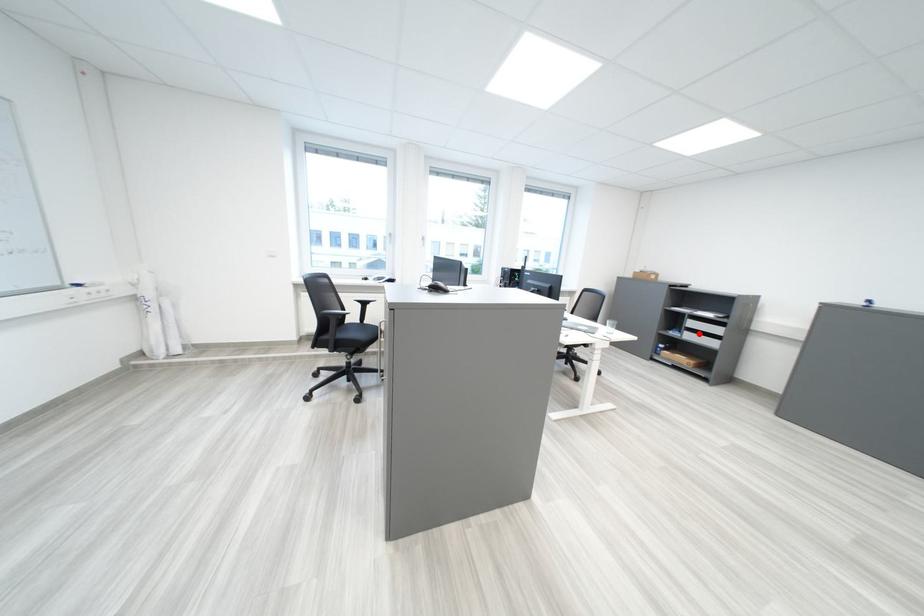
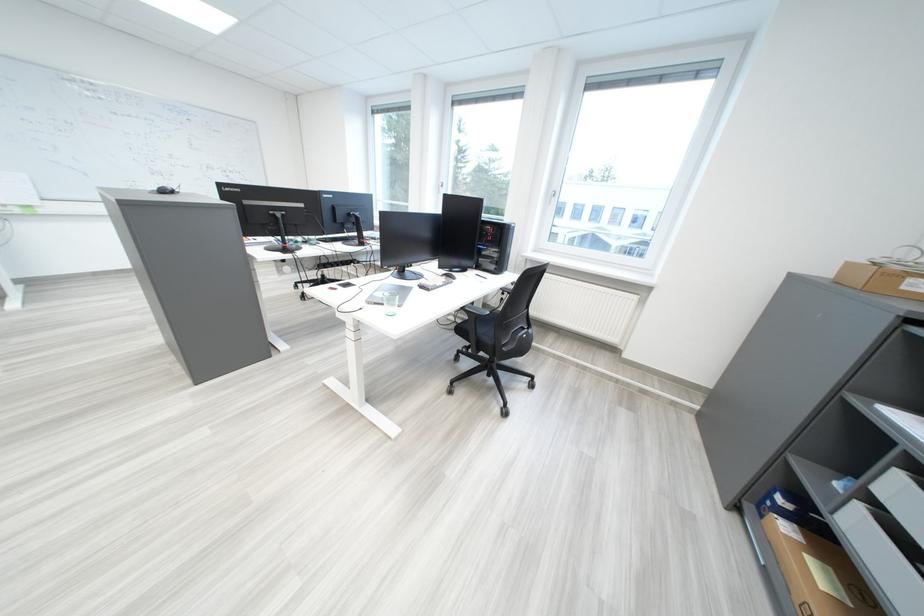
The point at the highlighted location is marked in the first image. Where is the corresponding point in the second image?

(873, 509)